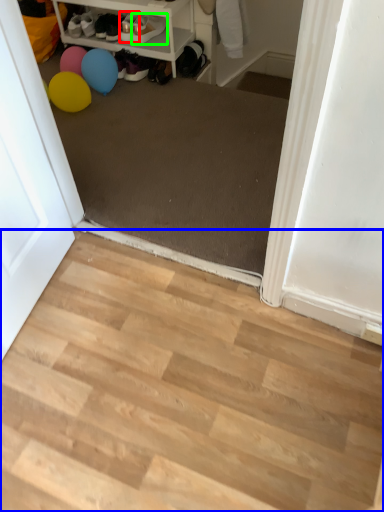
Question: Which object is the closest to the footwear (highlighted by a red box)? Choose among these: stairwell (highlighted by a blue box) or footwear (highlighted by a green box).

Choices:
 (A) stairwell
 (B) footwear

Answer: (B)